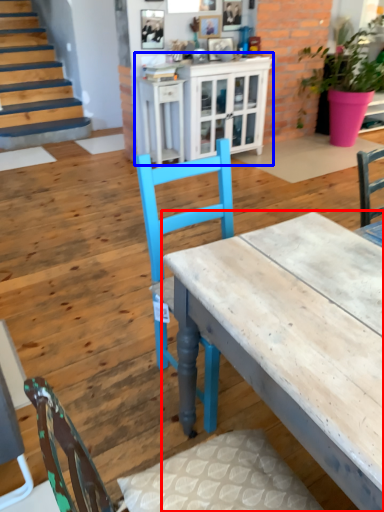
Question: Which object is further to the camera taking this photo, desk (highlighted by a red box) or cabinetry (highlighted by a blue box)?

Choices:
 (A) desk
 (B) cabinetry

Answer: (B)